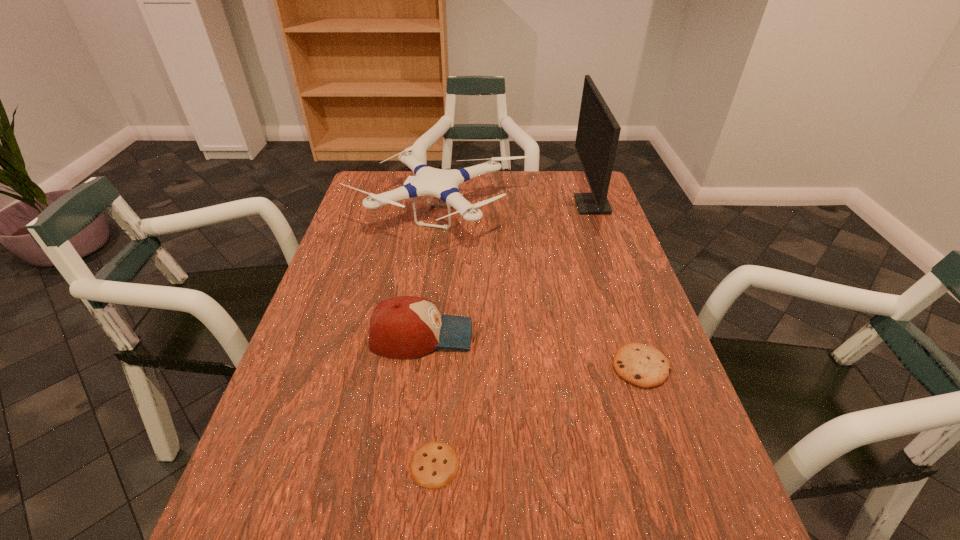
Identify the location of object that is at the far left corner. (444, 184).

At what (x,y) coordinates should I click in order to perform the action: click on object that is at the far right corner. Please return your answer as a coordinate pair (x, y). Looking at the image, I should click on (598, 131).

In the image, there is a desktop. Identify the location of blank space at the left edge. (356, 305).

Identify the location of free space at the right edge of the desktop. This screenshot has width=960, height=540. (609, 292).

Identify the location of free space at the far left corner. The width and height of the screenshot is (960, 540). (393, 186).

At what (x,y) coordinates should I click in order to perform the action: click on empty location between the computer monitor and the nearer cookie. Please return your answer as a coordinate pair (x, y). The height and width of the screenshot is (540, 960). Looking at the image, I should click on (514, 335).

Where is `vacant region between the second tallest object and the right cookie`? vacant region between the second tallest object and the right cookie is located at coordinates (540, 291).

Locate an element on the screen. Image resolution: width=960 pixels, height=540 pixels. unoccupied position between the second tallest object and the baseball cap is located at coordinates coord(431,275).

Locate an element on the screen. free point between the third shortest object and the farther cookie is located at coordinates (531, 352).

This screenshot has height=540, width=960. Identify the location of free space between the taller cookie and the fourth shortest object. (540, 291).